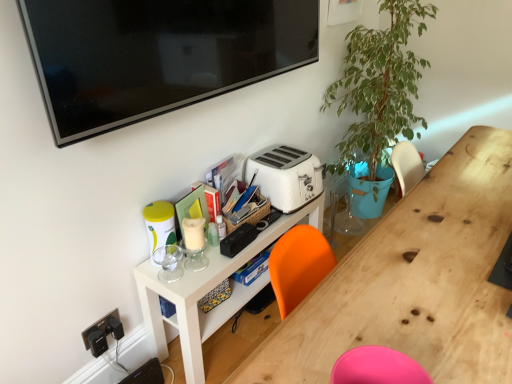
Question: Would you say green leafy plant at upper right is to the left or to the right of white matte shelf at center in the picture?

Choices:
 (A) left
 (B) right

Answer: (B)

Question: Is point (410, 61) positioned closer to the camera than point (178, 314)?

Choices:
 (A) farther
 (B) closer

Answer: (A)

Question: Considering the real-world distances, which object is closest to the white plastic toaster at center?

Choices:
 (A) white matte shelf at center
 (B) green leafy plant at upper right
 (C) wooden desk at center

Answer: (A)

Question: Estimate the real-world distances between objects in this image. Which object is farther from the wooden desk at center?

Choices:
 (A) white matte shelf at center
 (B) green leafy plant at upper right
 (C) white plastic toaster at center

Answer: (B)